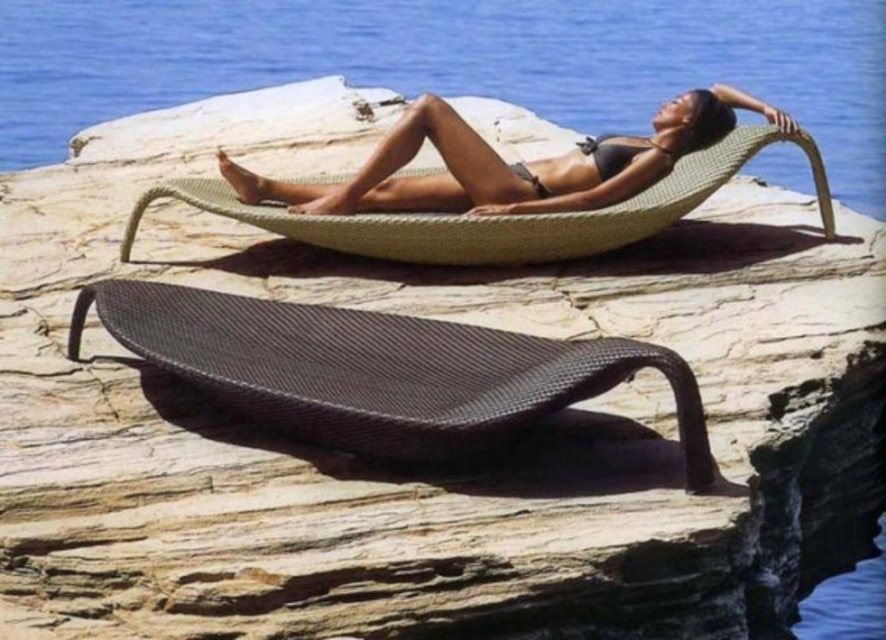
Can you confirm if matte black daybed at center is wider than beige woven hammock at center?

Correct, the width of matte black daybed at center exceeds that of beige woven hammock at center.

Who is taller, matte black daybed at center or beige woven hammock at center?

matte black daybed at center is taller.

The height and width of the screenshot is (640, 886). What are the coordinates of `matte black daybed at center` in the screenshot? It's located at (379, 371).

Does point (456, 49) lie in front of point (229, 177)?

No, (456, 49) is further to viewer.

Identify the location of clear blue water at upper center. (455, 61).

Who is more forward, (407, 134) or (684, 189)?

Point (407, 134) is more forward.

Between point (684, 115) and point (473, 246), which one is positioned in front?

Point (473, 246)

Where is `matte black bikini at center`? matte black bikini at center is located at coordinates [510, 163].